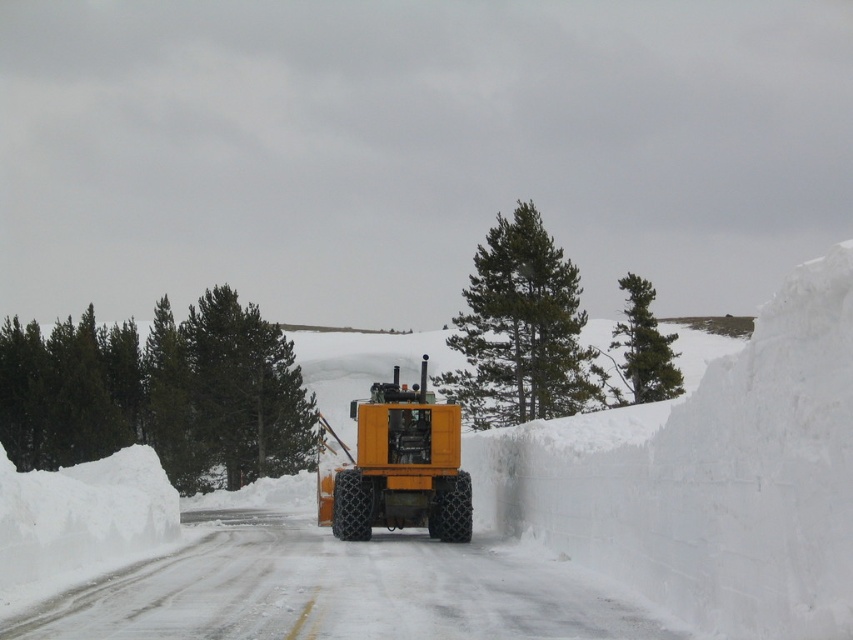
You are a delivery driver who needs to park your truck near the green matte pine at left without blocking the yellow rubber tractor at center. Based on their sizes, which object should you avoid placing your truck next to?

The green matte pine at left is larger in size than the yellow rubber tractor at center, so you should avoid placing your truck next to the green matte pine at left to ensure there is enough space for the yellow rubber tractor at center.

Looking at this image, you are a delivery driver who needs to park your truck near the yellow rubber tractor at center without blocking the green matte pine at left. Is there enough space between them to park your truck?

The green matte pine at left is taller than the yellow rubber tractor at center, so parking between them might not be possible due to the pine tree being taller and potentially obstructing the space. However, the question is about spatial positioning for parking, not height. Since the pine is at the left and the tractor is at the center, there is space between them along the road. The truck can park between them as long as it doesn